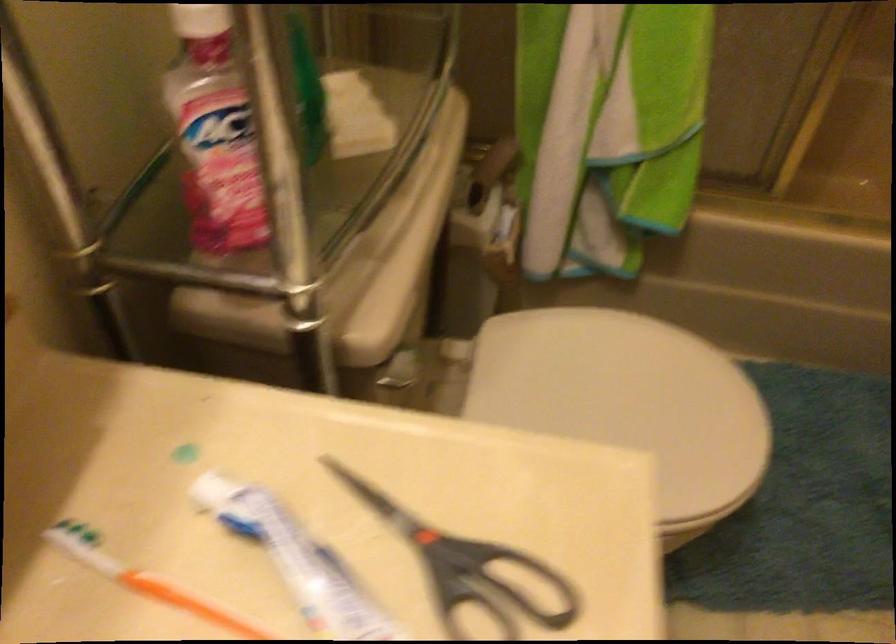
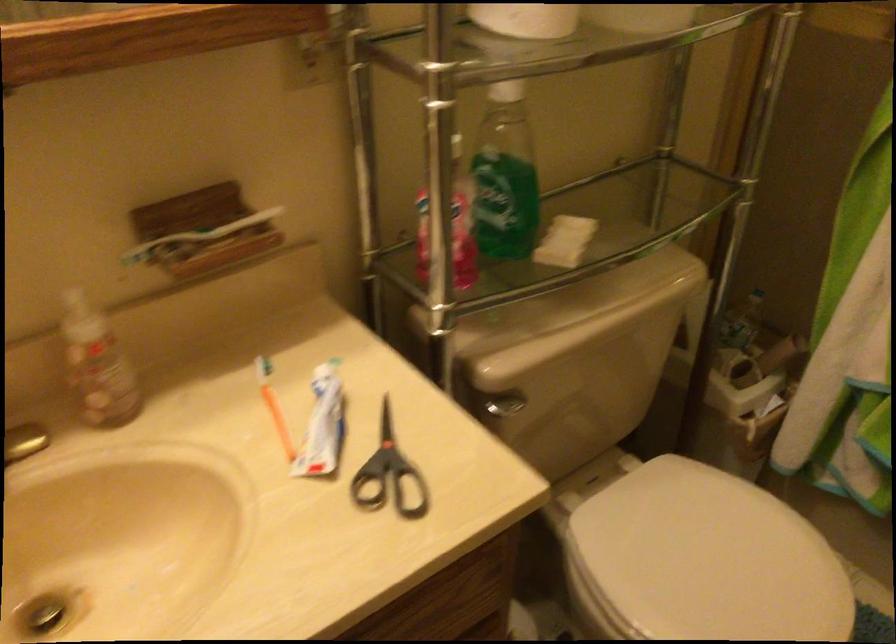
Find the pixel in the second image that matches (487,178) in the first image.

(764, 361)